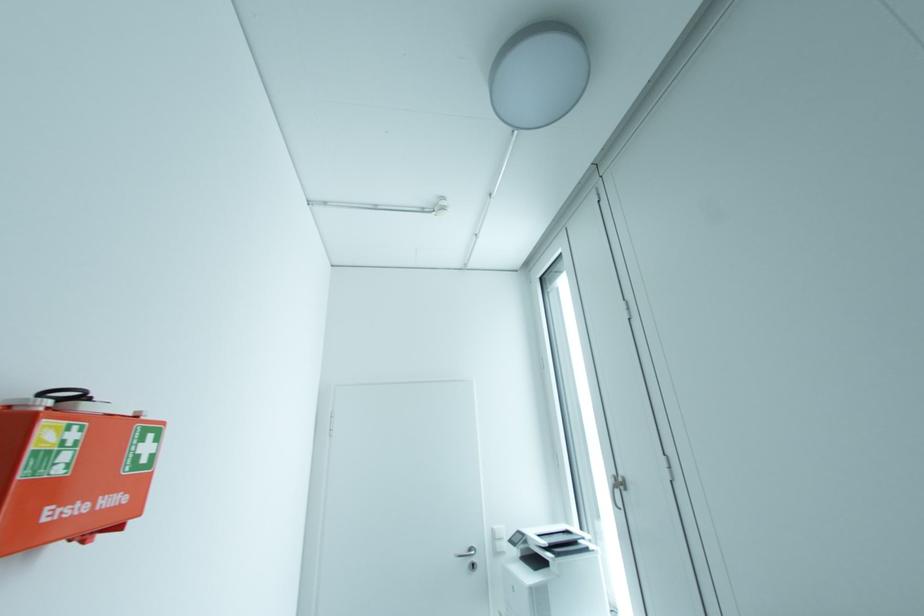
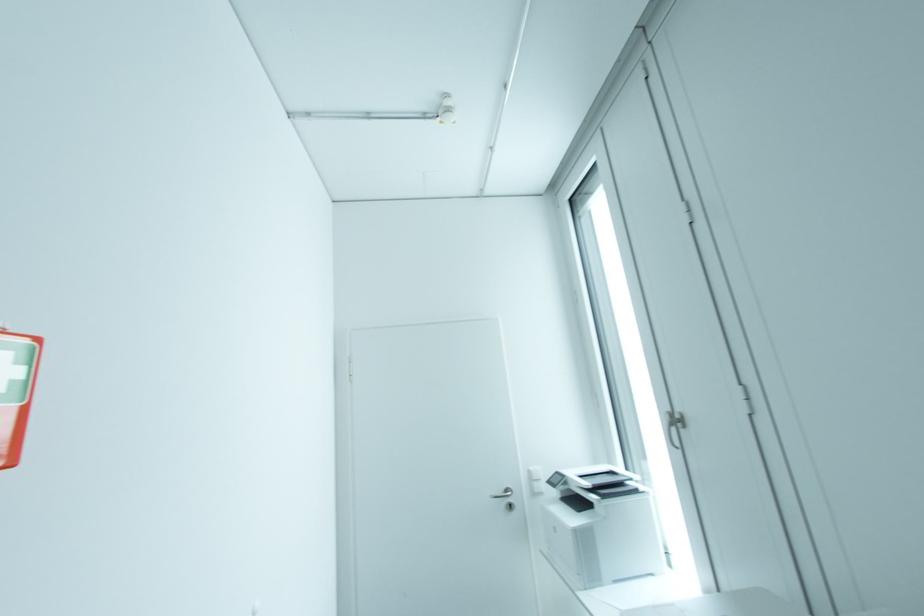
Question: Which direction would the cameraman need to move to produce the second image? Reply with the corresponding letter.

Choices:
 (A) Left
 (B) Right
 (C) Forward
 (D) Backward

Answer: (C)